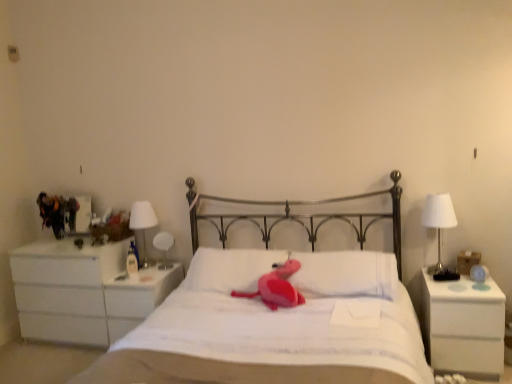
Locate an element on the screen. The image size is (512, 384). free space on the front side of white glossy table lamp at right, positioned as the 2th bedside lamp in left-to-right order is located at coordinates (450, 288).